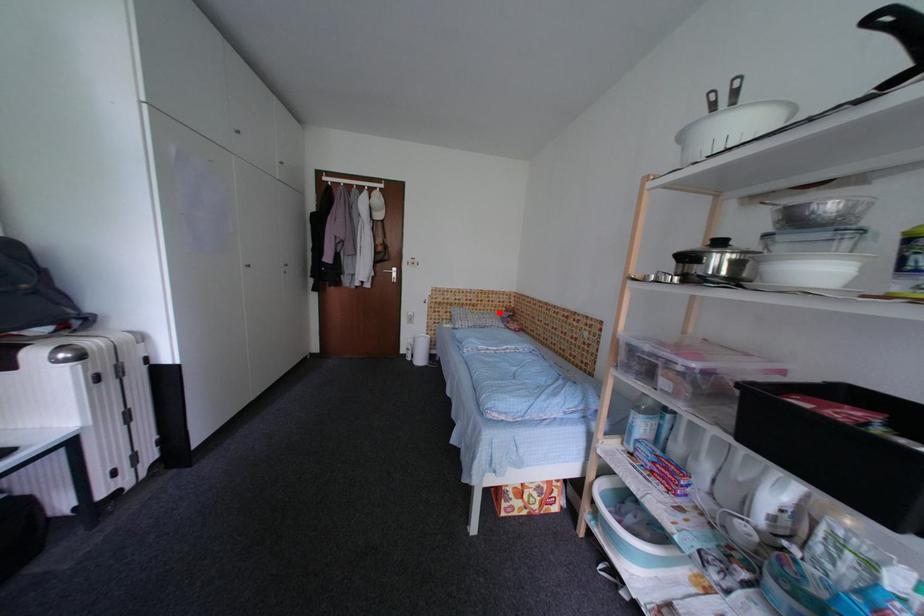
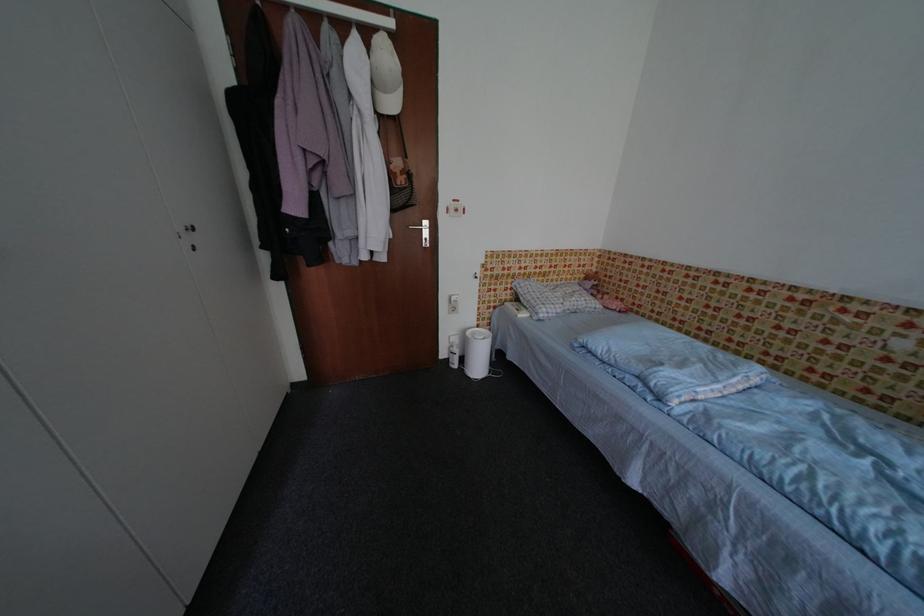
The point at the highlighted location is marked in the first image. Where is the corresponding point in the second image?

(574, 282)